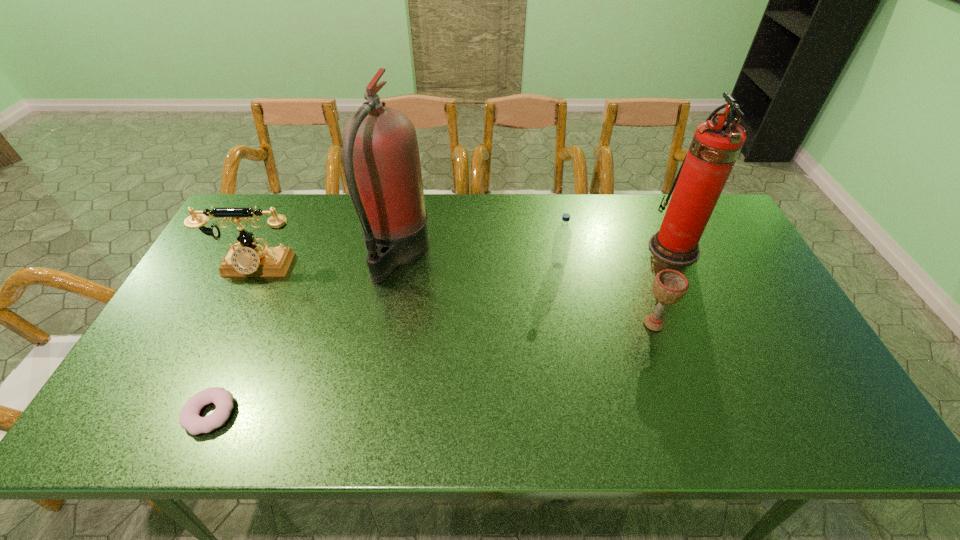
What are the coordinates of `vacant space located at the discharge end of the rightmost object` in the screenshot? It's located at (539, 248).

Image resolution: width=960 pixels, height=540 pixels. Find the location of `free point located at the discharge end of the rightmost object`. free point located at the discharge end of the rightmost object is located at coordinates (570, 248).

This screenshot has width=960, height=540. What are the coordinates of `free space located 0.100m on the dial of the telephone` in the screenshot? It's located at (235, 308).

You are a GUI agent. You are given a task and a screenshot of the screen. Output one action in this format:
    pyautogui.click(x=<x>, y=<y>)
    Task: Click on the vacant space situated 0.270m on the back of the third object from right to left
    
    Given the screenshot: What is the action you would take?
    pyautogui.click(x=547, y=207)

The image size is (960, 540). Find the location of `vacant position located on the back of the fifth farthest object`. vacant position located on the back of the fifth farthest object is located at coordinates (642, 291).

Where is `free spot located on the right of the nearest object`? This screenshot has height=540, width=960. free spot located on the right of the nearest object is located at coordinates (393, 414).

Identify the location of object that is at the near edge. The height and width of the screenshot is (540, 960). (189, 419).

Identify the location of telephone that is at the left edge. (252, 259).

Locate an element on the screen. Image resolution: width=960 pixels, height=540 pixels. doughnut that is at the left edge is located at coordinates (189, 419).

The image size is (960, 540). I want to click on object present at the right edge, so click(716, 144).